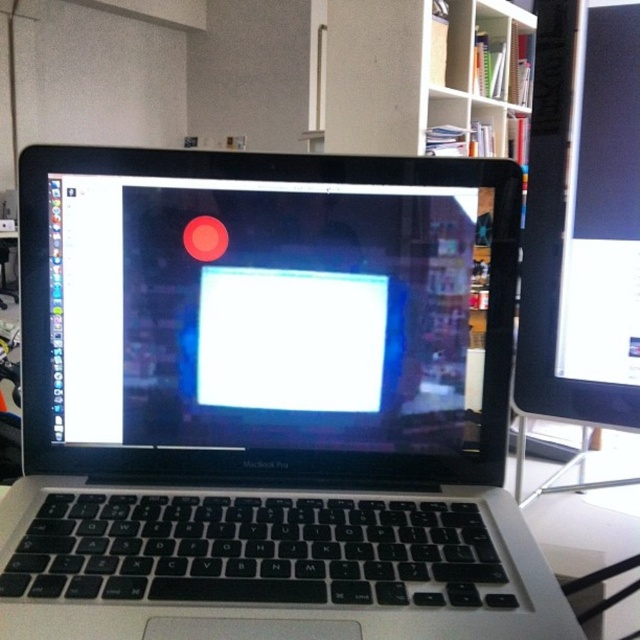
You are standing in front of the MacBook Pro laptop and see two points marked in the scene. Which point is closer to you, point at coordinates (184,403) or point at coordinates (552,13)?

Point at coordinates (184,403) is further to the viewer than point at coordinates (552,13), so the point at coordinates (552,13) is closer to you.